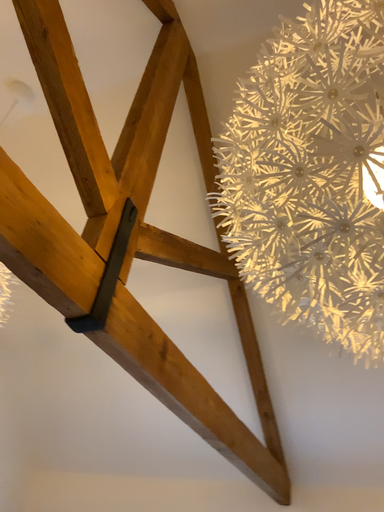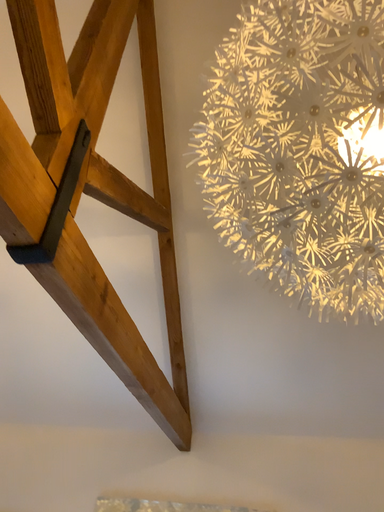
Question: Which way did the camera rotate in the video?

Choices:
 (A) rotated left
 (B) rotated right

Answer: (B)